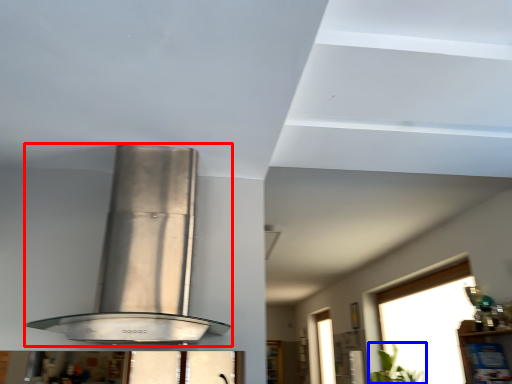
Question: Among these objects, which one is nearest to the camera, kitchen appliance (highlighted by a red box) or plant (highlighted by a blue box)?

Choices:
 (A) kitchen appliance
 (B) plant

Answer: (A)